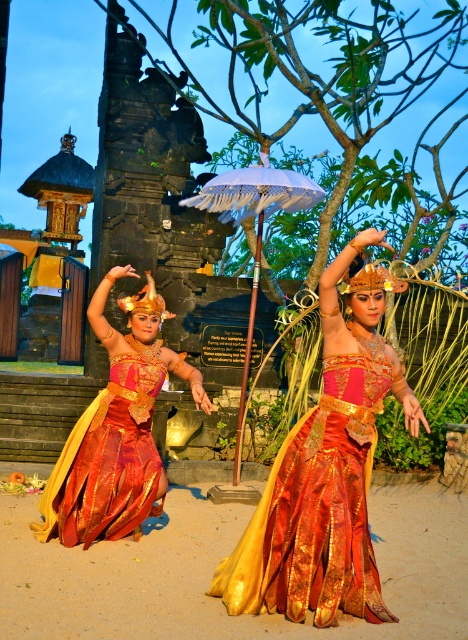
You are a photographer at the event and want to capture both the shiny gold dress at center and the white fringed umbrella at center in a single frame. Which object should you focus on first to ensure both are in the frame?

The shiny gold dress at center is smaller than the white fringed umbrella at center. To ensure both are in the frame, focus on the larger object first, which is the white fringed umbrella at center, then adjust to include the smaller shiny gold dress at center.

You are a photographer trying to capture both the shiny gold dress at center and the white fringed umbrella at center in the same frame. Which object should you focus on first to ensure both are in the frame?

The shiny gold dress at center is thinner than the white fringed umbrella at center, so you should focus on the wider white fringed umbrella at center first to ensure both fit in the frame.

You are a photographer trying to capture the dancers in the scene. You want to focus on the shiny silk skirt at center and the shiny gold dress at center. Which one is closer to the camera?

The shiny silk skirt at center is in front of the shiny gold dress at center, so it is closer to the camera.